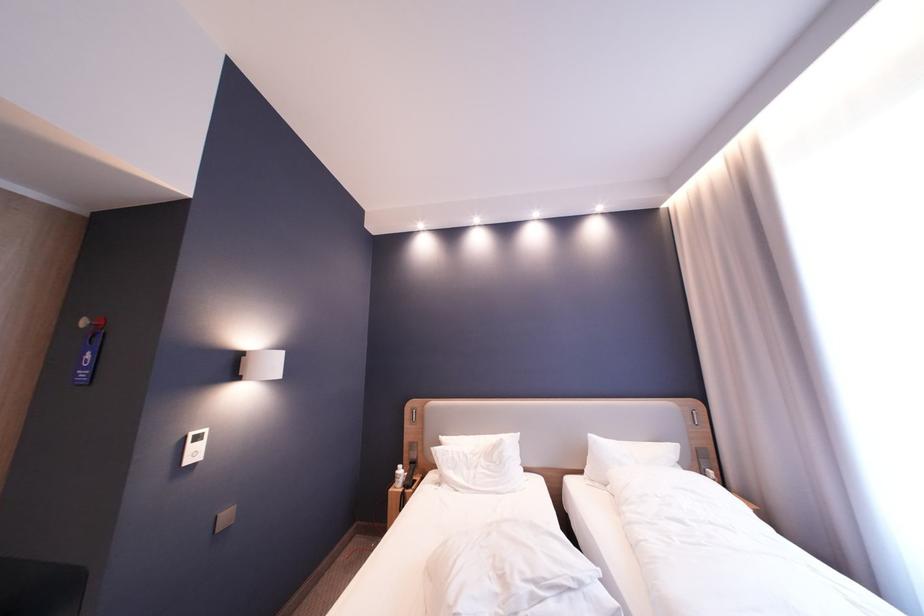
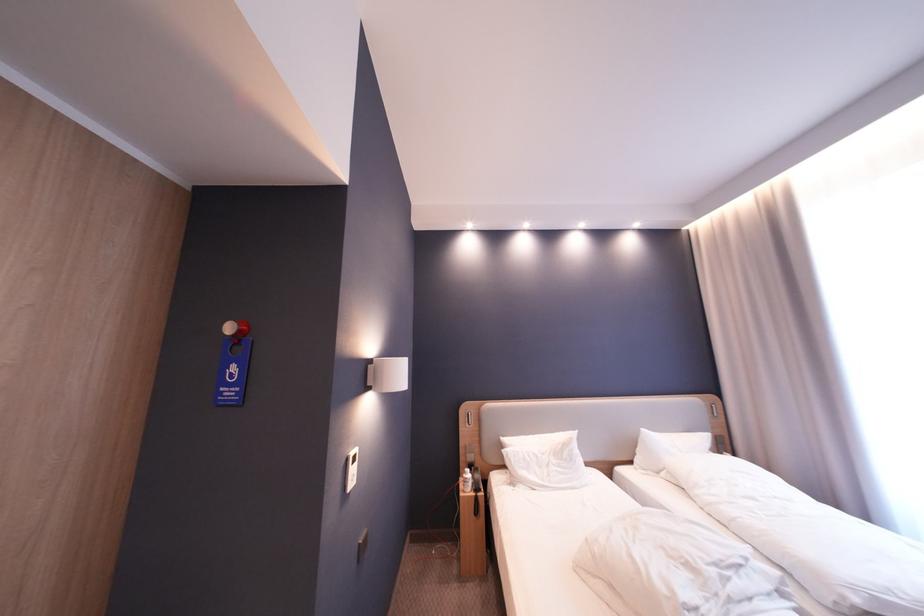
In the second image, find the point that corresponds to point (100, 357) in the first image.

(245, 370)